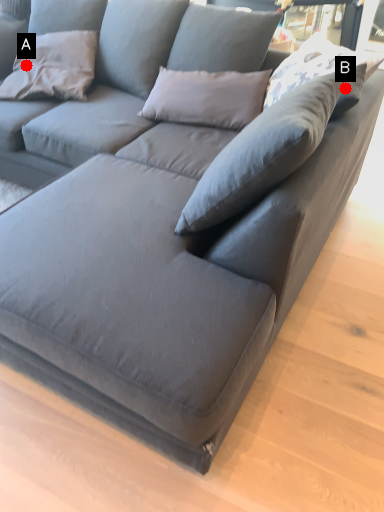
Question: Two points are circled on the image, labeled by A and B beside each circle. Among these points, which one is farthest from the camera?

Choices:
 (A) A is further
 (B) B is further

Answer: (A)